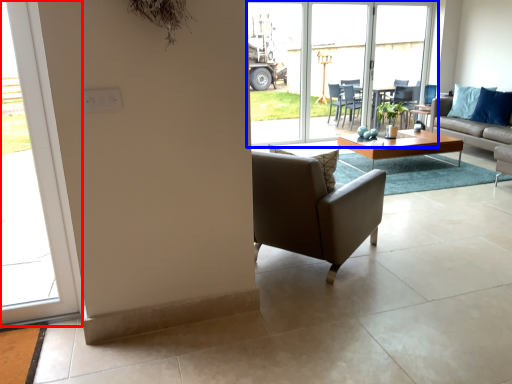
Question: Which of the following is the closest to the observer, window (highlighted by a red box) or window (highlighted by a blue box)?

Choices:
 (A) window
 (B) window

Answer: (A)